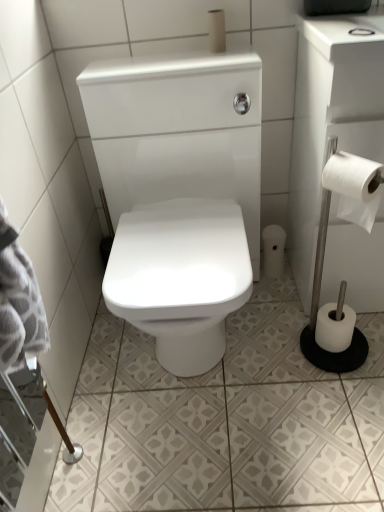
Question: Should I look upward or downward to see white paper roll at lower right, the 1th toilet paper viewed from the back?

Choices:
 (A) up
 (B) down

Answer: (A)

Question: Is white matte toilet paper at upper center, placed as the 4th toilet paper when sorted from bottom to top, directly adjacent to white paper roll at lower right, which is counted as the second toilet paper, starting from the bottom?

Choices:
 (A) yes
 (B) no

Answer: (B)

Question: Can you confirm if white matte toilet paper at upper center, acting as the fourth toilet paper starting from the right, is thinner than white paper roll at lower right, marked as the 2th toilet paper in a left-to-right arrangement?

Choices:
 (A) no
 (B) yes

Answer: (B)

Question: From a real-world perspective, is white matte toilet paper at upper center, the 1th toilet paper from the top, under white paper roll at lower right, the third toilet paper from the top?

Choices:
 (A) no
 (B) yes

Answer: (A)

Question: Is white matte toilet paper at upper center, acting as the fourth toilet paper starting from the right, far from white paper roll at lower right, marked as the 2th toilet paper in a left-to-right arrangement?

Choices:
 (A) no
 (B) yes

Answer: (A)

Question: Is white matte toilet paper at upper center, marked as the 3th toilet paper in a back-to-front arrangement, smaller than white paper roll at lower right, the 1th toilet paper viewed from the back?

Choices:
 (A) no
 (B) yes

Answer: (B)

Question: Is white matte toilet paper at upper center, which is counted as the first toilet paper, starting from the left, oriented towards white paper roll at lower right, the 1th toilet paper viewed from the back?

Choices:
 (A) no
 (B) yes

Answer: (A)

Question: Considering the relative positions of white paper roll at lower right, the fourth toilet paper when ordered from front to back, and white paper at right, positioned as the fourth toilet paper in back-to-front order, in the image provided, is white paper roll at lower right, the fourth toilet paper when ordered from front to back, behind white paper at right, positioned as the fourth toilet paper in back-to-front order,?

Choices:
 (A) no
 (B) yes

Answer: (B)

Question: Considering the relative sizes of white paper roll at lower right, which is counted as the second toilet paper, starting from the bottom, and white paper at right, positioned as the fourth toilet paper in back-to-front order, in the image provided, is white paper roll at lower right, which is counted as the second toilet paper, starting from the bottom, smaller than white paper at right, positioned as the fourth toilet paper in back-to-front order,?

Choices:
 (A) no
 (B) yes

Answer: (B)

Question: Can you confirm if white paper roll at lower right, the 3th toilet paper in the right-to-left sequence, is positioned to the left of white paper at right, the second toilet paper viewed from the right?

Choices:
 (A) yes
 (B) no

Answer: (A)

Question: From a real-world perspective, does white paper roll at lower right, the 1th toilet paper viewed from the back, stand above white paper at right, positioned as the fourth toilet paper in back-to-front order?

Choices:
 (A) no
 (B) yes

Answer: (A)

Question: From the image's perspective, would you say white paper roll at lower right, which is counted as the second toilet paper, starting from the bottom, is shown under white paper at right, which ranks as the 1th toilet paper in front-to-back order?

Choices:
 (A) no
 (B) yes

Answer: (B)

Question: Is white paper roll at lower right, the 1th toilet paper viewed from the back, shorter than white paper at right, the second toilet paper viewed from the right?

Choices:
 (A) yes
 (B) no

Answer: (A)

Question: Is white matte toilet paper at upper center, the 1th toilet paper from the top, further to the viewer compared to white paper at right, the second toilet paper viewed from the right?

Choices:
 (A) yes
 (B) no

Answer: (A)